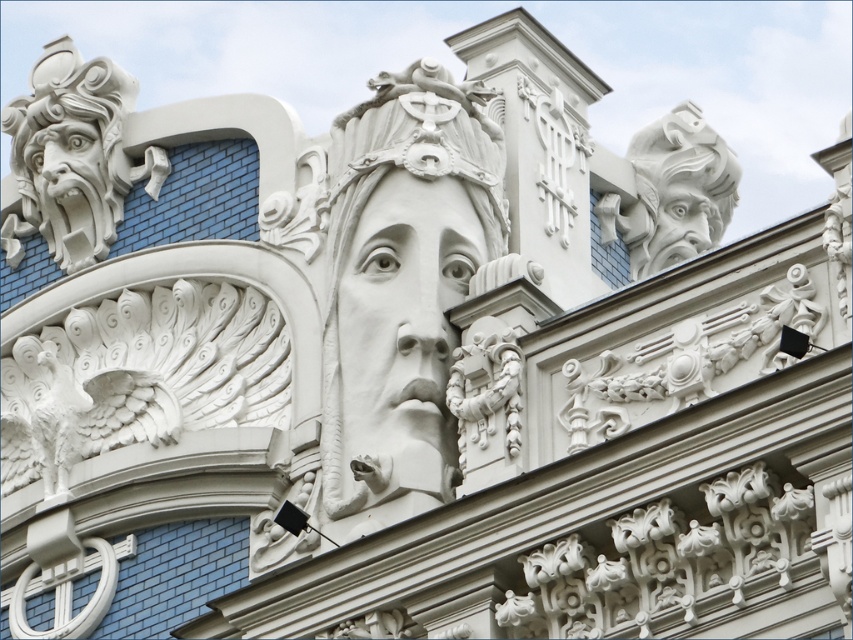
You are an architect examining the building facade. You need to determine the relative sizes of the white stone face at center and the white stone gargoyle at upper right. Which one is taller?

The white stone face at center is taller than the white stone gargoyle at upper right according to the description.

You are an architect examining this ornate building facade. You need to determine the vertical positioning of the white stone face at center and the white stone gargoyle at upper right. Which one is positioned higher on the facade?

The white stone gargoyle at upper right is positioned higher on the facade than the white stone face at center.

You are an architect examining the building facade. You notice two points marked on the image at coordinates point (428, 444) and point (407, 356). Which point is positioned closer to your viewpoint as you face the facade?

Point (428, 444) is closer to the camera than point (407, 356).